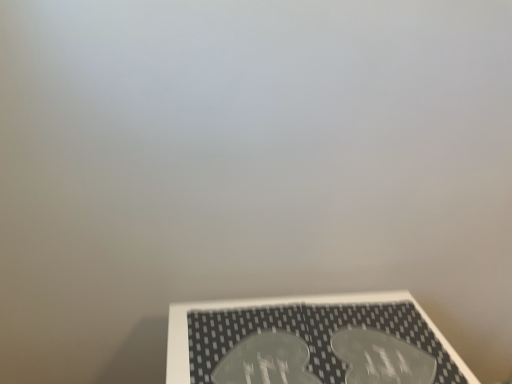
Describe the element at coordinates (310, 342) in the screenshot. I see `transparent plastic at bottom` at that location.

Where is `transparent plastic at bottom`? transparent plastic at bottom is located at coordinates (310, 342).

What is the approximate height of transparent plastic at bottom?

The height of transparent plastic at bottom is 2.35 centimeters.

You are a GUI agent. You are given a task and a screenshot of the screen. Output one action in this format:
    pyautogui.click(x=<x>, y=<y>)
    Task: Click on the transparent plastic at bottom
    This screenshot has height=384, width=512.
    Given the screenshot: What is the action you would take?
    pyautogui.click(x=310, y=342)